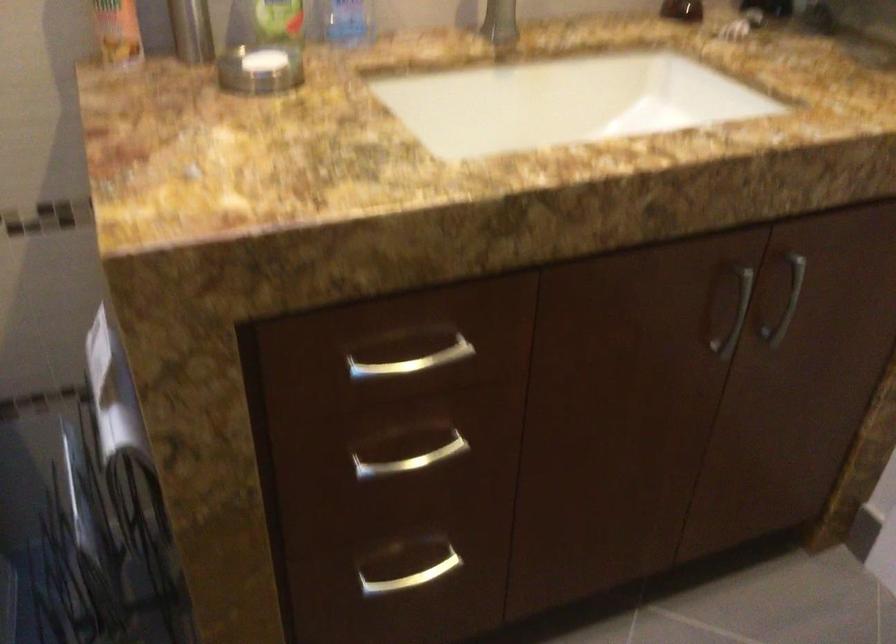
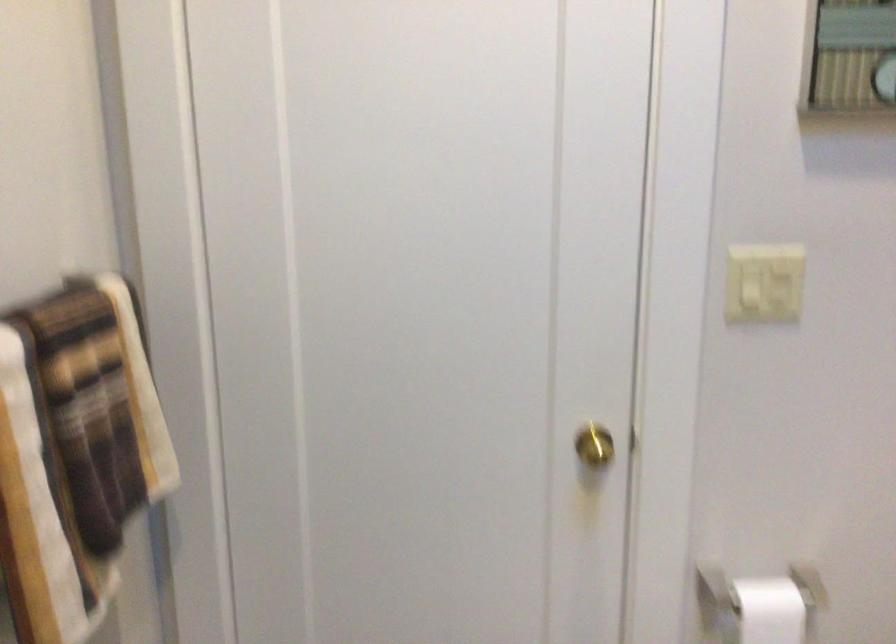
Based on the continuous images, in which direction is the camera rotating?

The rotation direction of the camera is left-down.